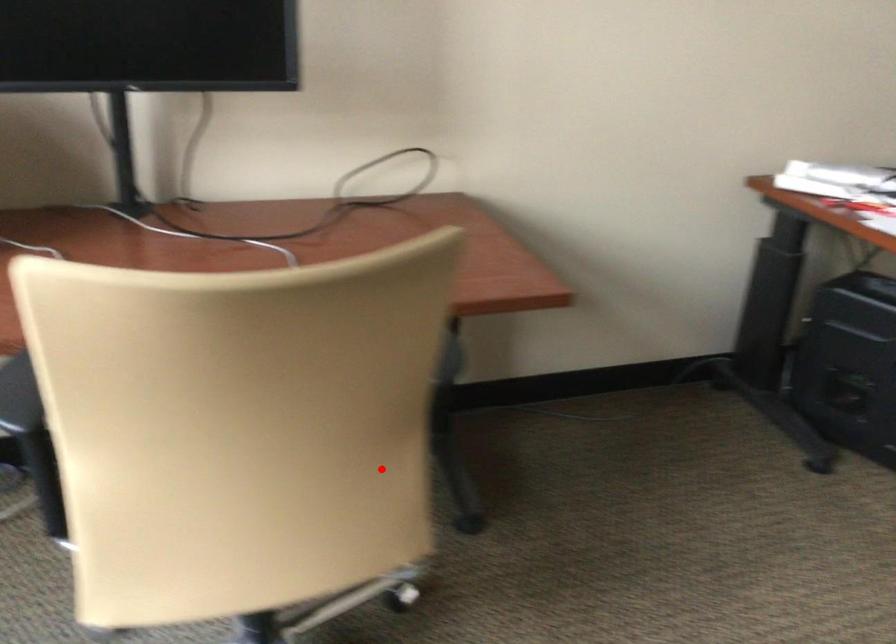
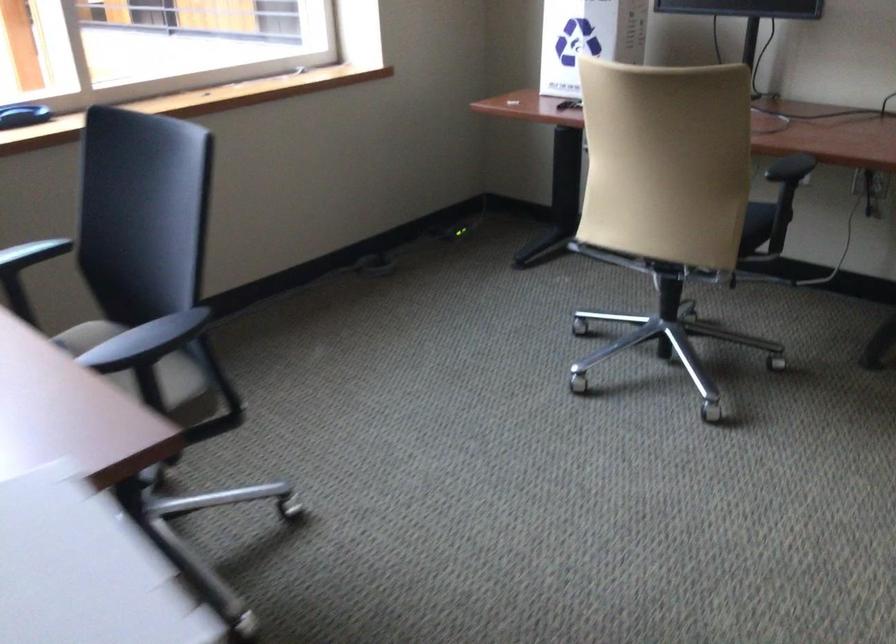
Where in the second image is the point corresponding to the highlighted location from the first image?

(755, 225)